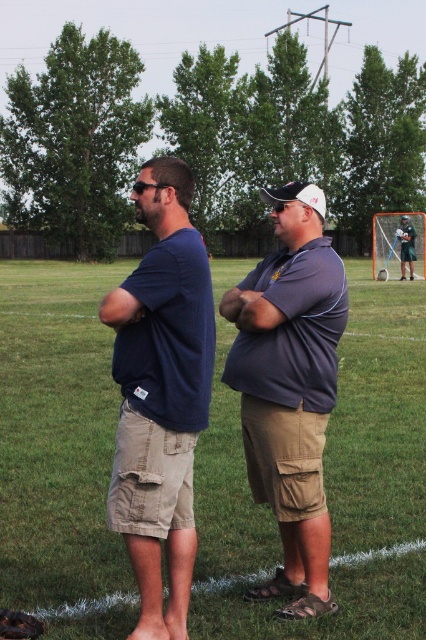
You are standing at the origin point of the coordinate system. The dark blue t shirt at center is located at point (161, 394). What direction do you need to move to reach the dark blue t shirt at center?

To reach the dark blue t shirt at center located at point (161, 394), you would need to move in the positive x and positive y direction from the origin point.